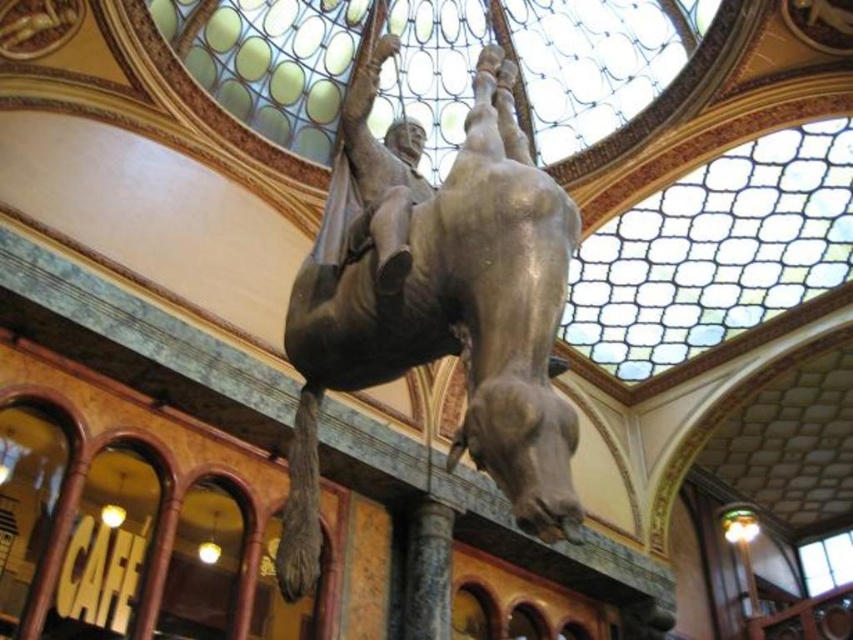
Question: Which object appears farthest from the camera in this image?

Choices:
 (A) bronze statue at center
 (B) granite column at center

Answer: (B)

Question: Which object appears farthest from the camera in this image?

Choices:
 (A) granite column at center
 (B) bronze statue at center

Answer: (A)

Question: Is bronze statue at center in front of granite column at center?

Choices:
 (A) yes
 (B) no

Answer: (A)

Question: Does bronze statue at center come behind granite column at center?

Choices:
 (A) yes
 (B) no

Answer: (B)

Question: Does bronze statue at center have a greater width compared to granite column at center?

Choices:
 (A) yes
 (B) no

Answer: (A)